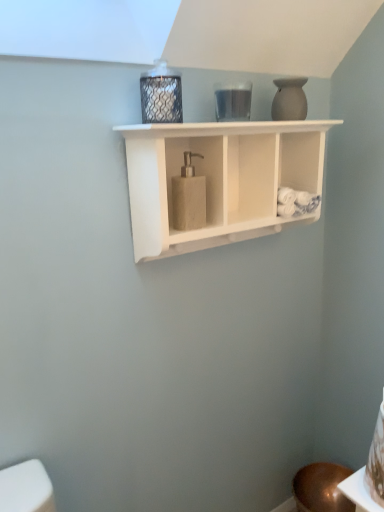
Question: Considering the positions of white matte soap dispenser at center and beige textured soap dispenser at center in the image, is white matte soap dispenser at center taller or shorter than beige textured soap dispenser at center?

Choices:
 (A) tall
 (B) short

Answer: (A)

Question: Is white matte soap dispenser at center inside the boundaries of beige textured soap dispenser at center, or outside?

Choices:
 (A) inside
 (B) outside

Answer: (B)

Question: Which object is positioned farthest from the white matte soap dispenser at center?

Choices:
 (A) beige textured soap dispenser at center
 (B) matte white vase at upper right

Answer: (B)

Question: Estimate the real-world distances between objects in this image. Which object is closer to the matte white vase at upper right?

Choices:
 (A) beige textured soap dispenser at center
 (B) white matte soap dispenser at center

Answer: (B)